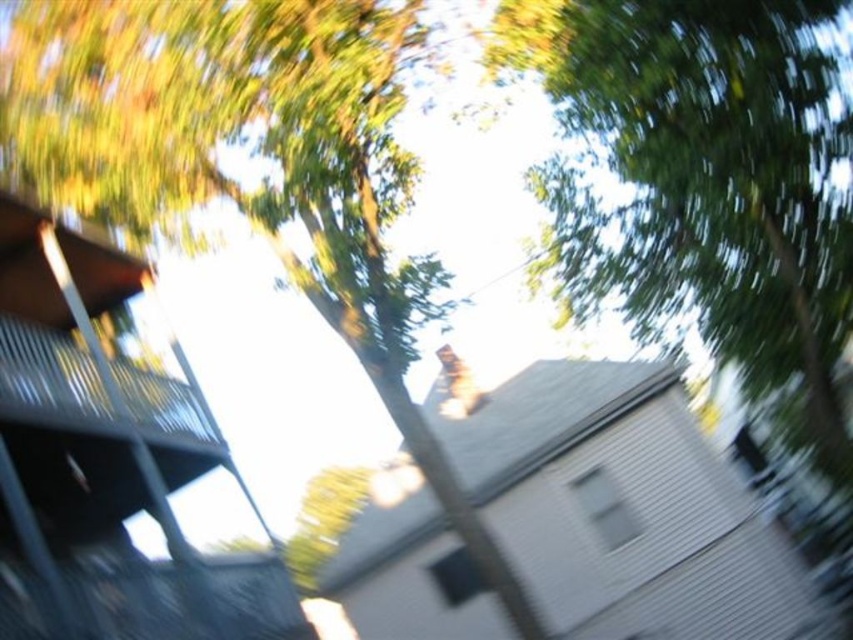
You are a painter standing in the middle of the scene. You want to paint the green leafy tree at upper center and the metallic gray balcony at left. Which object will require fewer brushstrokes to outline its shape?

The green leafy tree at upper center is thinner than the metallic gray balcony at left, so it will require fewer brushstrokes to outline its shape.

You are standing in the middle of the scene and want to look at the metallic gray balcony at left and the green leafy tree at upper center. Which object is positioned to the right side?

The green leafy tree at upper center is positioned to the right of the metallic gray balcony at left.

You are standing at the origin point in the image and want to throw a ball to hit both point (112, 195) and point (33, 552). Which point should you aim for first if you want to hit them in order from nearest to farthest?

You should aim for point (33, 552) first because it is closer to you than point (112, 195), which is farther away.